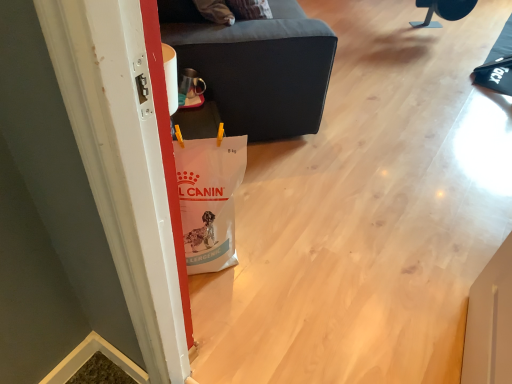
Find the location of `dark gray fabric ottoman at center, arranged as the second furniture when viewed from the right`. dark gray fabric ottoman at center, arranged as the second furniture when viewed from the right is located at coordinates (256, 66).

What do you see at coordinates (256, 66) in the screenshot?
I see `dark gray fabric ottoman at center, which appears as the 1th furniture when viewed from the front` at bounding box center [256, 66].

This screenshot has height=384, width=512. What do you see at coordinates (443, 11) in the screenshot? I see `black plastic chair at upper right, positioned as the 2th furniture in front-to-back order` at bounding box center [443, 11].

Locate an element on the screen. This screenshot has width=512, height=384. black plastic chair at upper right, which is the 1th furniture from right to left is located at coordinates (443, 11).

This screenshot has height=384, width=512. Find the location of `dark gray fabric ottoman at center, the first furniture when ordered from bottom to top`. dark gray fabric ottoman at center, the first furniture when ordered from bottom to top is located at coordinates (256, 66).

Between black plastic chair at upper right, the second furniture when ordered from left to right, and dark gray fabric ottoman at center, arranged as the second furniture when viewed from the right, which one appears on the right side from the viewer's perspective?

black plastic chair at upper right, the second furniture when ordered from left to right, is more to the right.

Is black plastic chair at upper right, which appears as the 2th furniture when ordered from the bottom, in front of or behind dark gray fabric ottoman at center, marked as the 2th furniture in a top-to-bottom arrangement, in the image?

black plastic chair at upper right, which appears as the 2th furniture when ordered from the bottom, is positioned farther from the viewer than dark gray fabric ottoman at center, marked as the 2th furniture in a top-to-bottom arrangement.

Which is closer to the camera, (x=424, y=4) or (x=243, y=57)?

The point (x=243, y=57) is closer to the camera.

From the image's perspective, is black plastic chair at upper right, which is counted as the first furniture, starting from the back, under dark gray fabric ottoman at center, arranged as the second furniture when viewed from the right?

No.

From a real-world perspective, which is physically above, black plastic chair at upper right, which appears as the 2th furniture when ordered from the bottom, or dark gray fabric ottoman at center, the 1th furniture positioned from the left?

In real-world perspective, dark gray fabric ottoman at center, the 1th furniture positioned from the left, is above.

Consider the image. Looking at their sizes, would you say black plastic chair at upper right, positioned as the 2th furniture in front-to-back order, is wider or thinner than dark gray fabric ottoman at center, the second furniture positioned from the back?

In the image, black plastic chair at upper right, positioned as the 2th furniture in front-to-back order, appears to be more narrow than dark gray fabric ottoman at center, the second furniture positioned from the back.

Considering the sizes of objects black plastic chair at upper right, which appears as the 2th furniture when ordered from the bottom, and dark gray fabric ottoman at center, the first furniture when ordered from bottom to top, in the image provided, who is shorter, black plastic chair at upper right, which appears as the 2th furniture when ordered from the bottom, or dark gray fabric ottoman at center, the first furniture when ordered from bottom to top,?

Standing shorter between the two is black plastic chair at upper right, which appears as the 2th furniture when ordered from the bottom.

From the picture: Does black plastic chair at upper right, which is the 1th furniture from right to left, have a larger size compared to dark gray fabric ottoman at center, marked as the 2th furniture in a top-to-bottom arrangement?

Incorrect, black plastic chair at upper right, which is the 1th furniture from right to left, is not larger than dark gray fabric ottoman at center, marked as the 2th furniture in a top-to-bottom arrangement.

Would you say black plastic chair at upper right, which is the 1th furniture from right to left, is outside dark gray fabric ottoman at center, marked as the 2th furniture in a top-to-bottom arrangement?

Yes, black plastic chair at upper right, which is the 1th furniture from right to left, is not within dark gray fabric ottoman at center, marked as the 2th furniture in a top-to-bottom arrangement.

Is there a large distance between black plastic chair at upper right, positioned as the 2th furniture in front-to-back order, and dark gray fabric ottoman at center, the 1th furniture positioned from the left?

Indeed, black plastic chair at upper right, positioned as the 2th furniture in front-to-back order, is not near dark gray fabric ottoman at center, the 1th furniture positioned from the left.

Does black plastic chair at upper right, which ranks as the 1th furniture in top-to-bottom order, turn towards dark gray fabric ottoman at center, the second furniture positioned from the back?

No, black plastic chair at upper right, which ranks as the 1th furniture in top-to-bottom order, does not turn towards dark gray fabric ottoman at center, the second furniture positioned from the back.

This screenshot has width=512, height=384. I want to click on furniture located below the black plastic chair at upper right, positioned as the 2th furniture in front-to-back order (from the image's perspective), so click(256, 66).

Does dark gray fabric ottoman at center, the second furniture positioned from the back, appear on the right side of black plastic chair at upper right, which is the 1th furniture from right to left?

In fact, dark gray fabric ottoman at center, the second furniture positioned from the back, is to the left of black plastic chair at upper right, which is the 1th furniture from right to left.

Considering their positions, is dark gray fabric ottoman at center, the first furniture when ordered from bottom to top, located in front of or behind black plastic chair at upper right, which appears as the 2th furniture when ordered from the bottom?

In the image, dark gray fabric ottoman at center, the first furniture when ordered from bottom to top, appears in front of black plastic chair at upper right, which appears as the 2th furniture when ordered from the bottom.

Is point (222, 53) closer or farther from the camera than point (431, 4)?

Point (222, 53).

From the image's perspective, does dark gray fabric ottoman at center, marked as the 2th furniture in a top-to-bottom arrangement, appear lower than black plastic chair at upper right, which is the 1th furniture from right to left?

Yes, from the image's perspective, dark gray fabric ottoman at center, marked as the 2th furniture in a top-to-bottom arrangement, is below black plastic chair at upper right, which is the 1th furniture from right to left.

From a real-world perspective, is dark gray fabric ottoman at center, the first furniture when ordered from bottom to top, above or below black plastic chair at upper right, the second furniture when ordered from left to right?

A: In terms of real-world spatial position, dark gray fabric ottoman at center, the first furniture when ordered from bottom to top, is above black plastic chair at upper right, the second furniture when ordered from left to right.

Can you confirm if dark gray fabric ottoman at center, which appears as the 1th furniture when viewed from the front, is wider than black plastic chair at upper right, which ranks as the 1th furniture in top-to-bottom order?

Yes.

In the scene shown: Considering the sizes of objects dark gray fabric ottoman at center, the first furniture when ordered from bottom to top, and black plastic chair at upper right, which appears as the 2th furniture when ordered from the bottom, in the image provided, who is shorter, dark gray fabric ottoman at center, the first furniture when ordered from bottom to top, or black plastic chair at upper right, which appears as the 2th furniture when ordered from the bottom,?

Standing shorter between the two is black plastic chair at upper right, which appears as the 2th furniture when ordered from the bottom.

Considering the sizes of dark gray fabric ottoman at center, the second furniture positioned from the back, and black plastic chair at upper right, positioned as the 2th furniture in front-to-back order, in the image, is dark gray fabric ottoman at center, the second furniture positioned from the back, bigger or smaller than black plastic chair at upper right, positioned as the 2th furniture in front-to-back order,?

In the image, dark gray fabric ottoman at center, the second furniture positioned from the back, appears to be larger than black plastic chair at upper right, positioned as the 2th furniture in front-to-back order.

Would you say dark gray fabric ottoman at center, the second furniture positioned from the back, contains black plastic chair at upper right, which is the 1th furniture from right to left?

No.

Is dark gray fabric ottoman at center, the second furniture positioned from the back, with black plastic chair at upper right, which is counted as the first furniture, starting from the back?

dark gray fabric ottoman at center, the second furniture positioned from the back, and black plastic chair at upper right, which is counted as the first furniture, starting from the back, are not in contact.

Could you tell me if dark gray fabric ottoman at center, the 1th furniture positioned from the left, is turned towards black plastic chair at upper right, which is counted as the first furniture, starting from the back?

Yes, dark gray fabric ottoman at center, the 1th furniture positioned from the left, is facing black plastic chair at upper right, which is counted as the first furniture, starting from the back.

From the picture: How many degrees apart are the facing directions of dark gray fabric ottoman at center, marked as the 2th furniture in a top-to-bottom arrangement, and black plastic chair at upper right, positioned as the 2th furniture in front-to-back order?

The angle between the facing direction of dark gray fabric ottoman at center, marked as the 2th furniture in a top-to-bottom arrangement, and the facing direction of black plastic chair at upper right, positioned as the 2th furniture in front-to-back order, is 95.2 degrees.

Locate an element on the screen. The image size is (512, 384). furniture below the black plastic chair at upper right, which appears as the 2th furniture when ordered from the bottom (from the image's perspective) is located at coordinates (256, 66).

I want to click on furniture lying in front of the black plastic chair at upper right, which ranks as the 1th furniture in top-to-bottom order, so click(x=256, y=66).

The width and height of the screenshot is (512, 384). I want to click on furniture on the right of the dark gray fabric ottoman at center, the first furniture when ordered from bottom to top, so click(x=443, y=11).